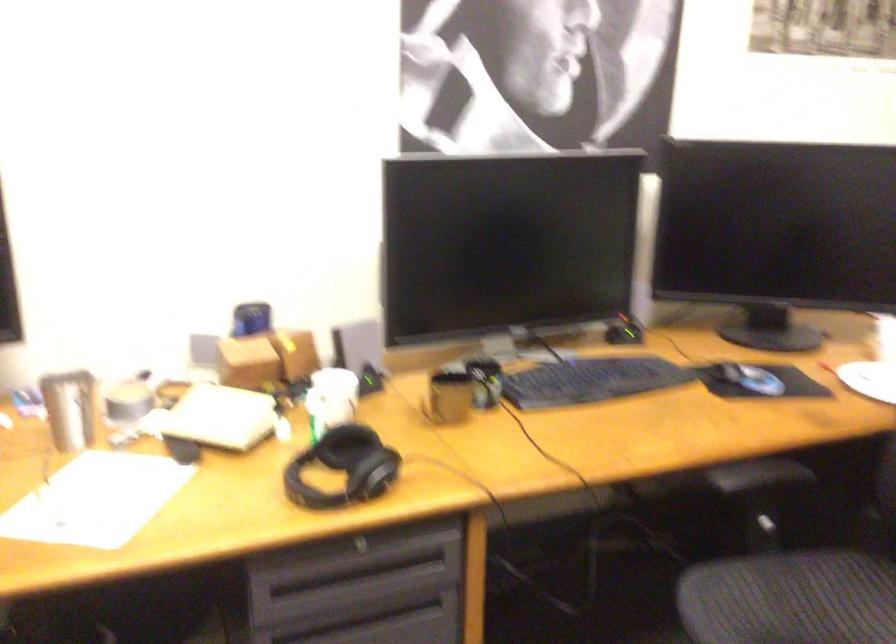
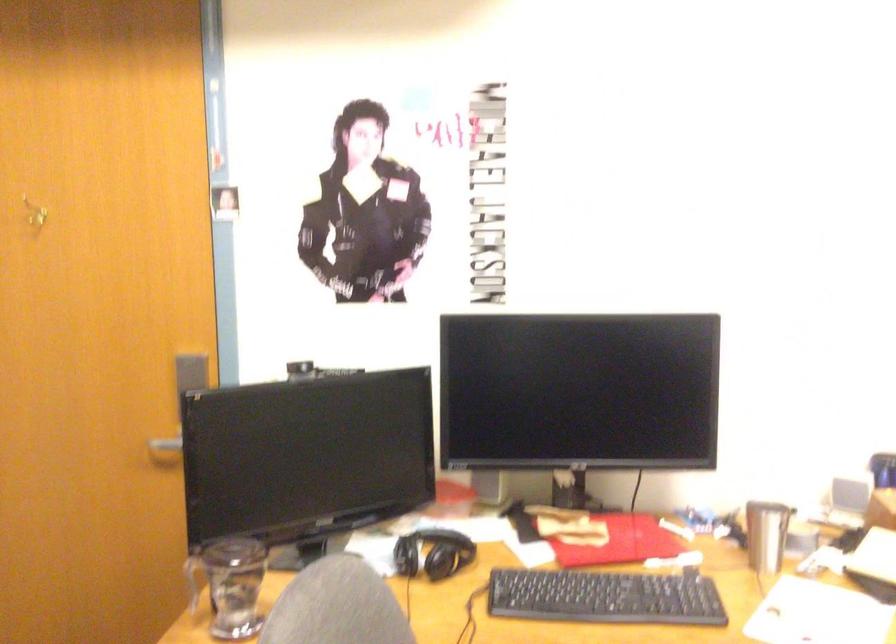
Question: The camera is either moving clockwise (left) or counter-clockwise (right) around the object. The first image is from the beginning of the video and the second image is from the end. Is the camera moving left or right when shooting the video?

Choices:
 (A) Left
 (B) Right

Answer: (B)